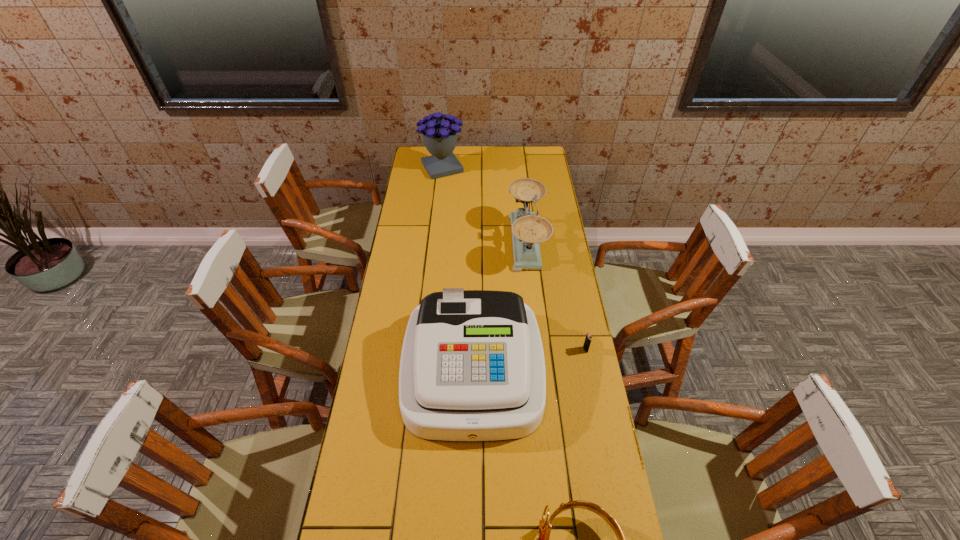
This screenshot has width=960, height=540. What are the coordinates of `vacant area between the igniter and the second farthest object` in the screenshot? It's located at (556, 296).

Identify the location of unoccupied area between the bouquet and the scale. (484, 205).

Where is `object that is the nearest to the cash register`? The height and width of the screenshot is (540, 960). object that is the nearest to the cash register is located at coordinates (587, 342).

Locate which object ranks fourth in proximity to the shortest object. Please provide its 2D coordinates. Your answer should be formatted as a tuple, i.e. [(x, y)], where the tuple contains the x and y coordinates of a point satisfying the conditions above.

[(440, 137)]

Where is `vacant region that satisfies the following two spatial constraints: 1. on the front-facing side of the scale; 2. on the right side of the igniter`? The image size is (960, 540). vacant region that satisfies the following two spatial constraints: 1. on the front-facing side of the scale; 2. on the right side of the igniter is located at coordinates (538, 349).

Find the location of a particular element. This screenshot has height=540, width=960. vacant area in the image that satisfies the following two spatial constraints: 1. on the front side of the tallest object; 2. on the right side of the cash register is located at coordinates (420, 369).

Identify the location of vacant space that satisfies the following two spatial constraints: 1. on the front side of the cash register; 2. on the left side of the farthest object. This screenshot has width=960, height=540. (420, 369).